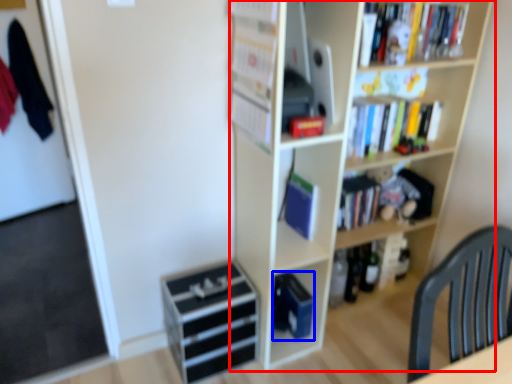
Question: Which object appears closest to the camera in this image, bookcase (highlighted by a red box) or paperback book (highlighted by a blue box)?

Choices:
 (A) bookcase
 (B) paperback book

Answer: (A)